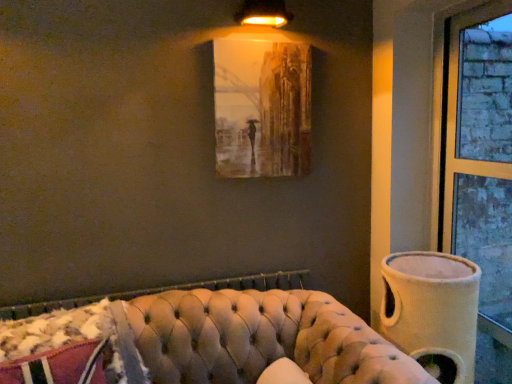
Question: From a real-world perspective, does matte brown painting at upper center stand above tufted leather couch at lower center?

Choices:
 (A) yes
 (B) no

Answer: (A)

Question: Are matte brown painting at upper center and tufted leather couch at lower center far apart?

Choices:
 (A) yes
 (B) no

Answer: (B)

Question: Is tufted leather couch at lower center inside matte brown painting at upper center?

Choices:
 (A) yes
 (B) no

Answer: (B)

Question: Is matte brown painting at upper center behind tufted leather couch at lower center?

Choices:
 (A) no
 (B) yes

Answer: (B)

Question: From the image's perspective, is matte brown painting at upper center on tufted leather couch at lower center?

Choices:
 (A) no
 (B) yes

Answer: (B)

Question: Is beige fabric vase at right in front of or behind matte gold lampshade at upper center in the image?

Choices:
 (A) behind
 (B) front

Answer: (B)

Question: From their relative heights in the image, would you say beige fabric vase at right is taller or shorter than matte gold lampshade at upper center?

Choices:
 (A) tall
 (B) short

Answer: (A)

Question: From a real-world perspective, is beige fabric vase at right physically located above or below matte gold lampshade at upper center?

Choices:
 (A) below
 (B) above

Answer: (A)

Question: Is beige fabric vase at right inside the boundaries of matte gold lampshade at upper center, or outside?

Choices:
 (A) outside
 (B) inside

Answer: (A)

Question: Looking at their shapes, would you say tufted leather couch at lower center is wider or thinner than beige fabric vase at right?

Choices:
 (A) wide
 (B) thin

Answer: (A)

Question: From the image's perspective, is tufted leather couch at lower center located above or below beige fabric vase at right?

Choices:
 (A) above
 (B) below

Answer: (B)

Question: In the image, is tufted leather couch at lower center positioned in front of or behind beige fabric vase at right?

Choices:
 (A) front
 (B) behind

Answer: (A)

Question: From a real-world perspective, is tufted leather couch at lower center above or below beige fabric vase at right?

Choices:
 (A) above
 (B) below

Answer: (B)

Question: Is point (259, 1) positioned closer to the camera than point (413, 311)?

Choices:
 (A) farther
 (B) closer

Answer: (A)

Question: Considering the positions of matte gold lampshade at upper center and beige fabric vase at right in the image, is matte gold lampshade at upper center wider or thinner than beige fabric vase at right?

Choices:
 (A) wide
 (B) thin

Answer: (B)